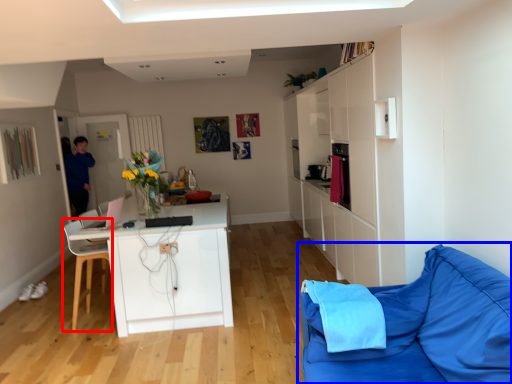
Question: Which object appears farthest to the camera in this image, chair (highlighted by a red box) or studio couch (highlighted by a blue box)?

Choices:
 (A) chair
 (B) studio couch

Answer: (A)